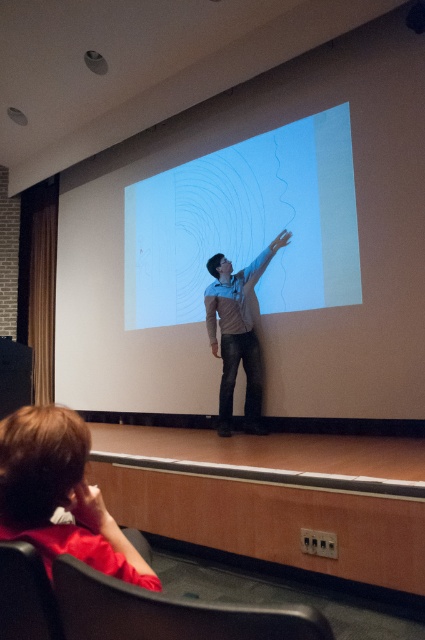
Question: Which of the following is the farthest from the observer?

Choices:
 (A) white matte projection screen at center
 (B) black fabric chair at lower left
 (C) black leather chair at lower left
 (D) denim jeans at center

Answer: (D)

Question: Which object is positioned farthest from the white matte projection screen at center?

Choices:
 (A) black fabric chair at lower left
 (B) black leather chair at lower left
 (C) denim jeans at center

Answer: (B)

Question: Does black leather chair at lower left have a smaller size compared to denim jeans at center?

Choices:
 (A) yes
 (B) no

Answer: (A)

Question: Is denim jeans at center positioned behind black fabric chair at lower left?

Choices:
 (A) no
 (B) yes

Answer: (B)

Question: Is white matte projection screen at center below denim jeans at center?

Choices:
 (A) yes
 (B) no

Answer: (B)

Question: Among these objects, which one is farthest from the camera?

Choices:
 (A) white matte projection screen at center
 (B) black fabric chair at lower left

Answer: (A)